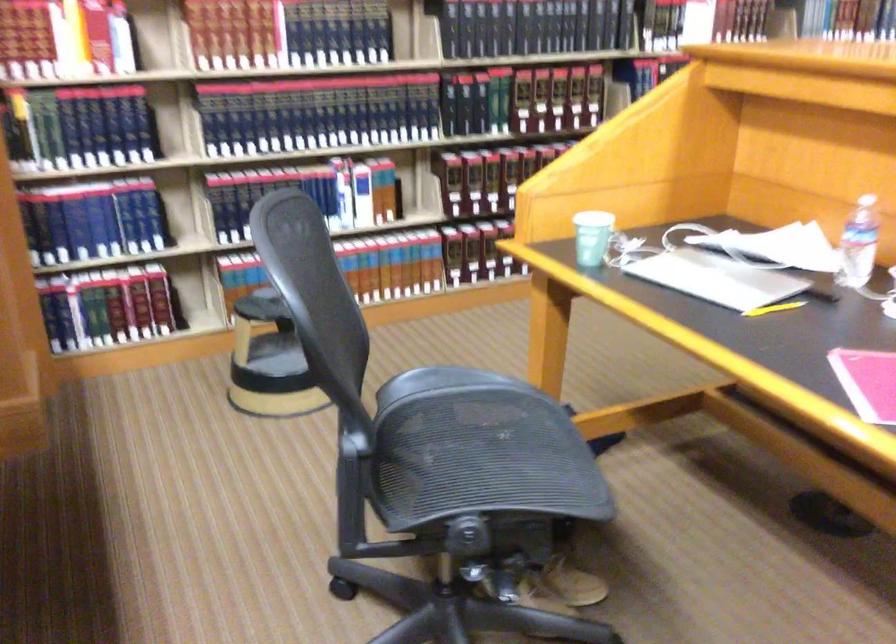
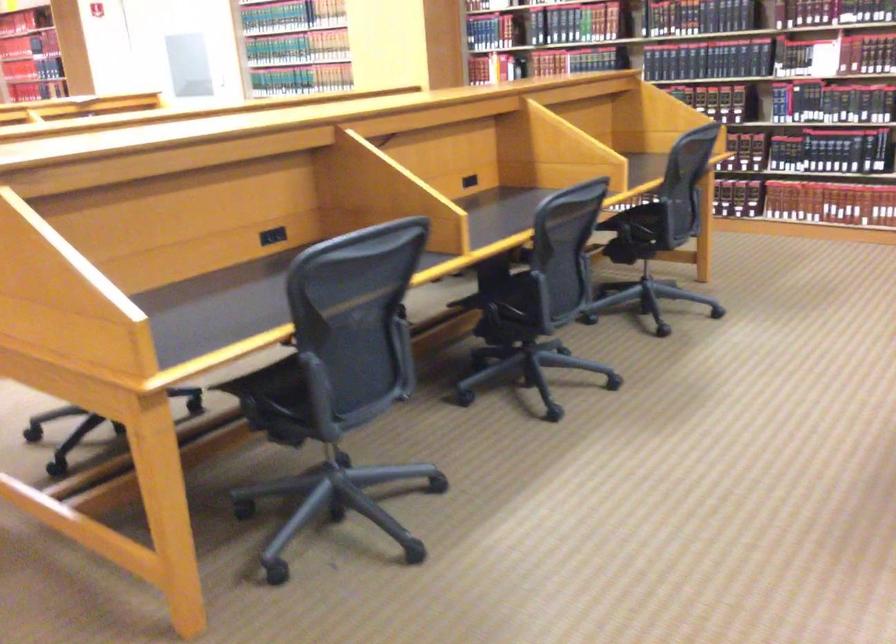
Question: I am providing you with two images of the same scene from different viewpoints. Which of the following objects are not visible in image2?

Choices:
 (A) black power outlet
 (B) dark flip-flop
 (C) chair armrest
 (D) hardcover book

Answer: (D)